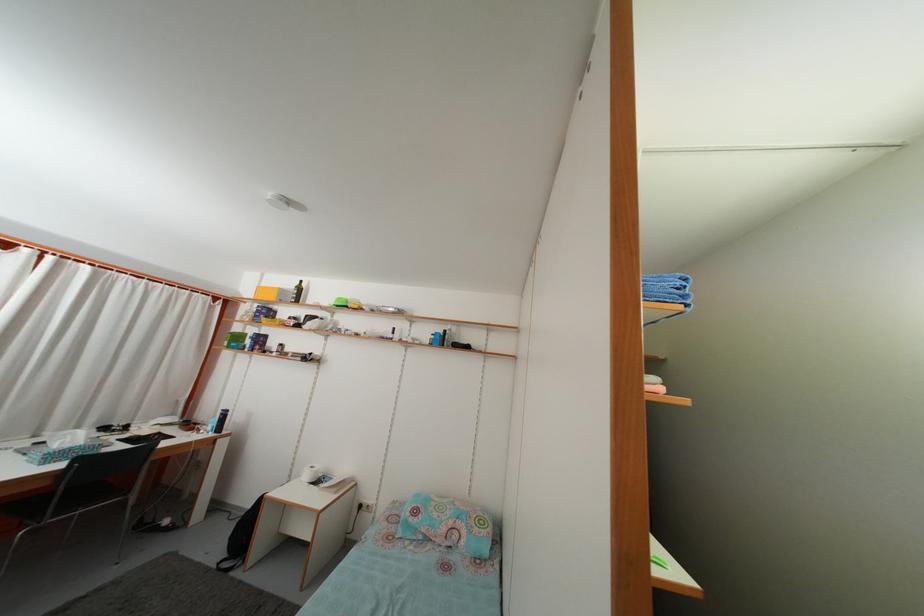
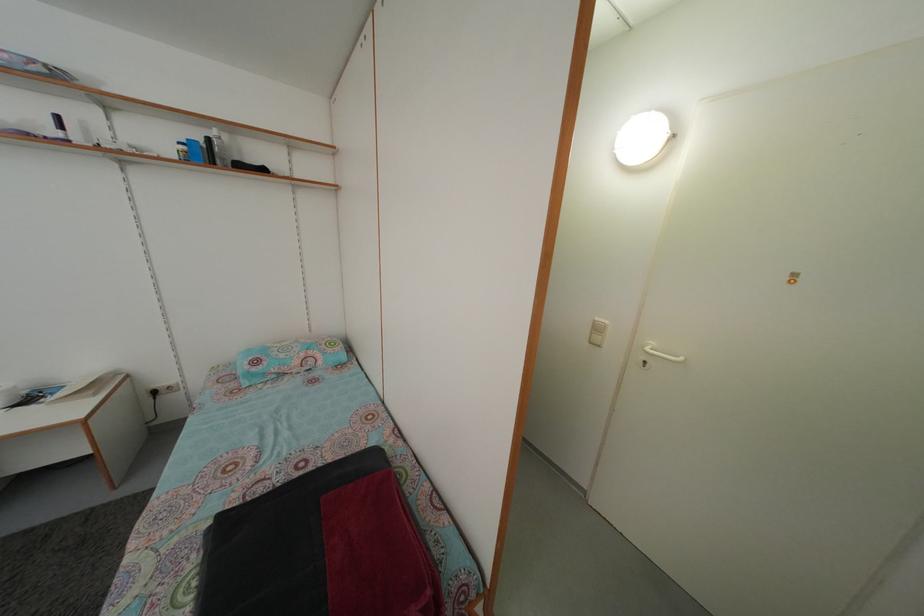
The point at (463,347) is marked in the first image. Where is the corresponding point in the second image?

(242, 166)